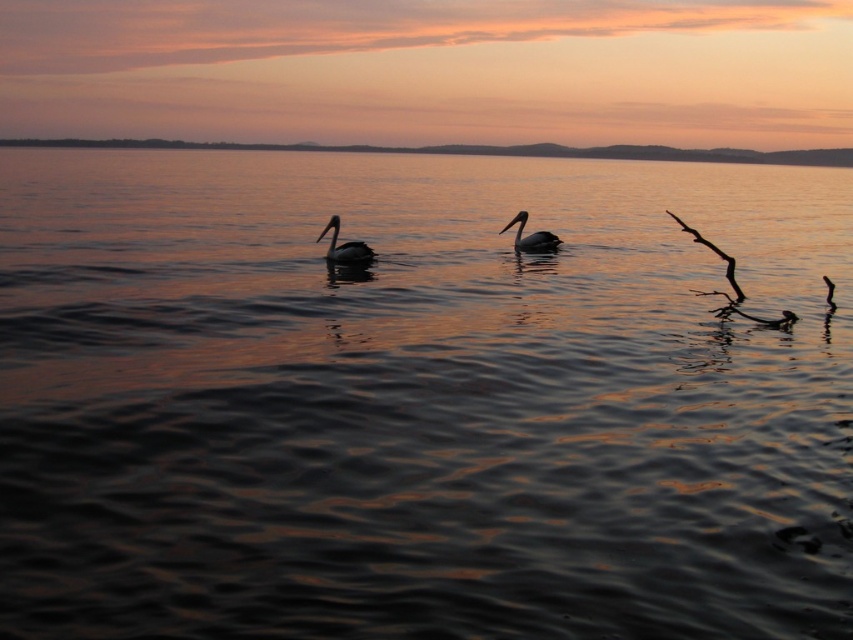
From the picture: You are an observer watching the sunset scene. You notice two birds on the water. Which one is closer to the left edge of the image between the dark gray matte pelican at center and the matte gray duck at center?

The dark gray matte pelican at center is to the left of the matte gray duck at center, so it is closer to the left edge of the image.